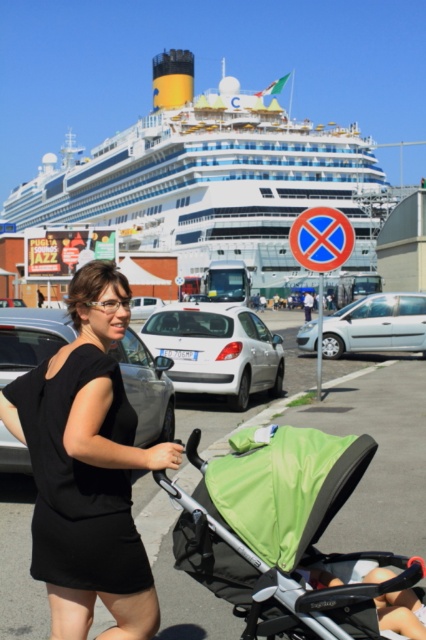
In the scene shown: Is metallic silver car at center wider than soft fabric baby carriage at center?

Yes.

Can you confirm if metallic silver car at center is taller than soft fabric baby carriage at center?

Yes.

Does point (135, 372) come closer to viewer compared to point (414, 608)?

No, (135, 372) is further to viewer.

Locate an element on the screen. metallic silver car at center is located at coordinates coord(146,388).

Who is shorter, light blue metallic car at center or soft fabric baby carriage at center?

soft fabric baby carriage at center is shorter.

Between point (354, 349) and point (319, 572), which one is positioned behind?

Positioned behind is point (354, 349).

Where is `light blue metallic car at center`? Image resolution: width=426 pixels, height=640 pixels. light blue metallic car at center is located at coordinates (377, 324).

Does black fabric dress at center have a larger size compared to light blue metallic car at center?

Incorrect, black fabric dress at center is not larger than light blue metallic car at center.

Does black fabric dress at center appear under light blue metallic car at center?

Yes, black fabric dress at center is below light blue metallic car at center.

Identify the location of black fabric dress at center. This screenshot has height=640, width=426. (88, 467).